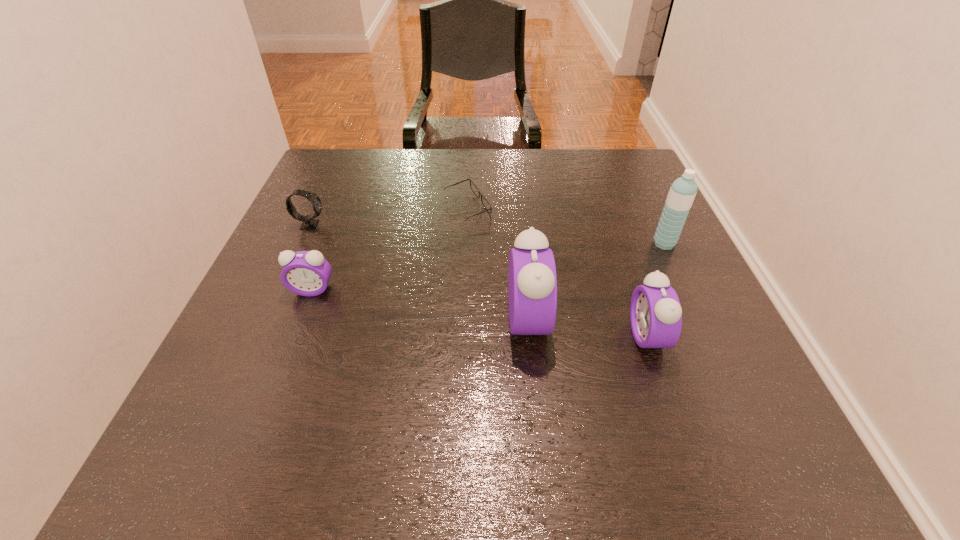
Select which alarm clock is the closest to the watch. Please provide its 2D coordinates. Your answer should be formatted as a tuple, i.e. [(x, y)], where the tuple contains the x and y coordinates of a point satisfying the conditions above.

[(307, 273)]

Identify which alarm clock is the third nearest to the third farthest object. Please provide its 2D coordinates. Your answer should be formatted as a tuple, i.e. [(x, y)], where the tuple contains the x and y coordinates of a point satisfying the conditions above.

[(307, 273)]

The height and width of the screenshot is (540, 960). I want to click on free spot that satisfies the following two spatial constraints: 1. on the front side of the rightmost object; 2. on the face of the tallest alarm clock, so click(x=700, y=320).

This screenshot has width=960, height=540. I want to click on free space that satisfies the following two spatial constraints: 1. on the face of the fourth nearest object; 2. on the right side of the watch, so click(301, 244).